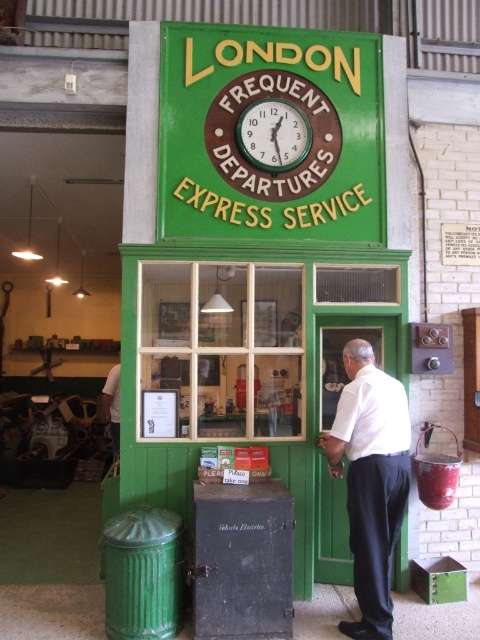
You are standing in front of the vintage green signboard and notice two points marked on it. Which point, point (154, 262) or point (250, 120), is closer to you?

Point (154, 262) is closer to the viewer than point (250, 120).

You are an interior designer assessing the wall space in the workshop. You need to know if the green wooden window at center can fit vertically in the space currently occupied by the green painted wood clock at upper center. Based on their sizes, what would you advise?

The green wooden window at center has a greater height than the green painted wood clock at upper center, so it cannot fit vertically in the clock area since it is taller.

You are an interior designer assessing the wall space in the workshop. You need to know which object occupies more area on the wall between the white shirt at center and the green painted wood clock at upper center. Which one is larger?

The white shirt at center is larger in size than the green painted wood clock at upper center, so the white shirt at center occupies more area on the wall.